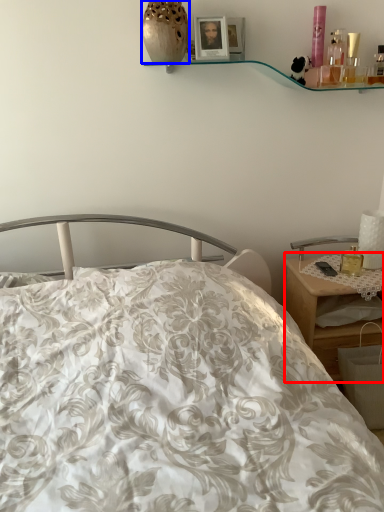
Question: Among these objects, which one is nearest to the camera, desk (highlighted by a red box) or vase (highlighted by a blue box)?

Choices:
 (A) desk
 (B) vase

Answer: (B)